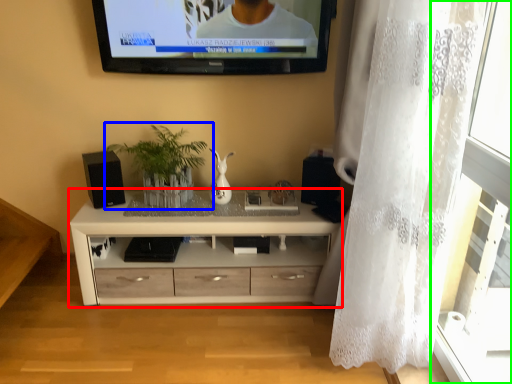
Question: Which object is the closest to the chest of drawers (highlighted by a red box)? Choose among these: houseplant (highlighted by a blue box) or glass door (highlighted by a green box).

Choices:
 (A) houseplant
 (B) glass door

Answer: (A)